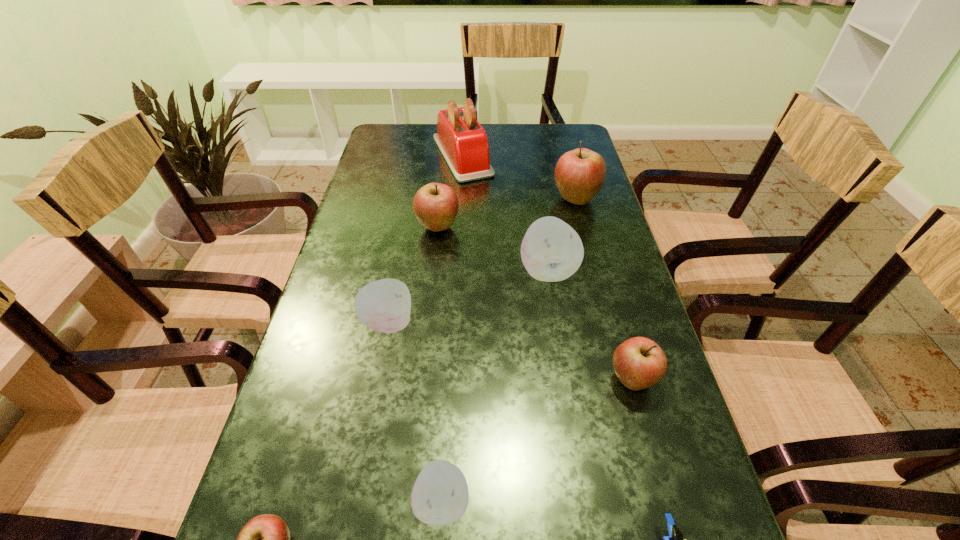
This screenshot has width=960, height=540. Find the location of `object located at the left edge`. object located at the left edge is located at coordinates coord(384,305).

Image resolution: width=960 pixels, height=540 pixels. In the image, there is a desktop. In order to click on vacant space at the left edge in this screenshot , I will do `click(247, 517)`.

I want to click on vacant space at the right edge of the desktop, so click(x=627, y=490).

At what (x,y) coordinates should I click in order to perform the action: click on free space between the nearest white apple and the farthest object. Please return your answer as a coordinate pair (x, y). Looking at the image, I should click on (452, 329).

This screenshot has width=960, height=540. I want to click on free spot between the fifth nearest apple and the farthest object, so click(505, 213).

You are a GUI agent. You are given a task and a screenshot of the screen. Output one action in this format:
    pyautogui.click(x=<x>, y=<y>)
    Task: Click on the free area in between the leftmost white apple and the fourth farthest object
    
    Given the screenshot: What is the action you would take?
    pyautogui.click(x=468, y=296)

The image size is (960, 540). I want to click on free area in between the biggest red apple and the second nearest red apple, so click(604, 289).

Identify which object is located as the second nearest to the leftmost white apple. Please provide its 2D coordinates. Your answer should be formatted as a tuple, i.e. [(x, y)], where the tuple contains the x and y coordinates of a point satisfying the conditions above.

[(551, 250)]

I want to click on object identified as the fourth closest to the farthest white apple, so click(384, 305).

Find the location of a particular element. apple that is the fifth closest one to the biggest white apple is located at coordinates (440, 495).